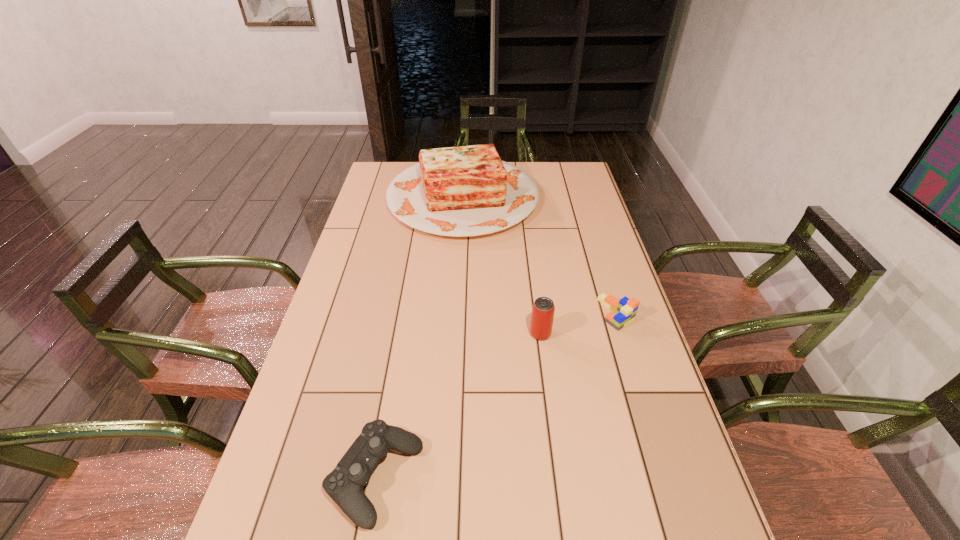
Identify the location of vacant point located between the lasagna and the control. This screenshot has height=540, width=960. (420, 338).

Where is `vacant space in between the control and the second tallest object`? The height and width of the screenshot is (540, 960). vacant space in between the control and the second tallest object is located at coordinates (458, 406).

Point out which object is positioned as the second nearest to the nearest object. Please provide its 2D coordinates. Your answer should be formatted as a tuple, i.e. [(x, y)], where the tuple contains the x and y coordinates of a point satisfying the conditions above.

[(623, 311)]

Where is `object that is the third nearest to the control`? object that is the third nearest to the control is located at coordinates (463, 191).

At what (x,y) coordinates should I click in order to perform the action: click on vacant space that satisfies the following two spatial constraints: 1. on the back side of the lasagna; 2. on the left side of the control. Please return your answer as a coordinate pair (x, y). The image size is (960, 540). Looking at the image, I should click on (424, 197).